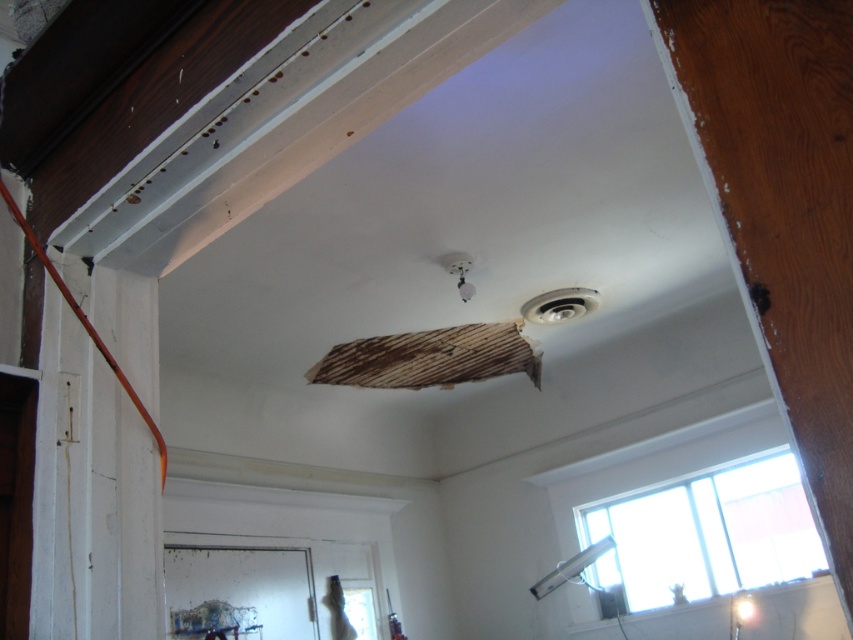
This screenshot has width=853, height=640. What do you see at coordinates (740, 611) in the screenshot?
I see `matte white light fixture at lower right` at bounding box center [740, 611].

Which is in front, point (749, 611) or point (469, 262)?

Point (469, 262)

Locate an element on the screen. The height and width of the screenshot is (640, 853). matte white light fixture at lower right is located at coordinates (740, 611).